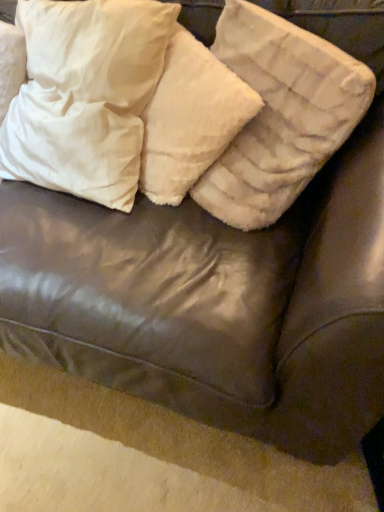
Identify the location of white fluffy pillow at upper center, the 2th pillow positioned from the right. (190, 118).

The image size is (384, 512). What do you see at coordinates (190, 118) in the screenshot? I see `white fluffy pillow at upper center, the 2th pillow positioned from the right` at bounding box center [190, 118].

At what (x,y) coordinates should I click in order to perform the action: click on white fluffy pillow at upper center, the 2th pillow positioned from the right. Please return your answer as a coordinate pair (x, y). The width and height of the screenshot is (384, 512). Looking at the image, I should click on (190, 118).

From the image's perspective, who appears lower, white soft pillow at upper left, which is the 3th pillow in right-to-left order, or white fluffy pillow at upper center, marked as the 1th pillow in a right-to-left arrangement?

From the image's view, white fluffy pillow at upper center, marked as the 1th pillow in a right-to-left arrangement, is below.

Who is more distant, white soft pillow at upper left, which is the 3th pillow in right-to-left order, or white fluffy pillow at upper center, marked as the 1th pillow in a right-to-left arrangement?

white soft pillow at upper left, which is the 3th pillow in right-to-left order, is further away from the camera.

Is white soft pillow at upper left, positioned as the 1th pillow in left-to-right order, oriented away from white fluffy pillow at upper center, marked as the 1th pillow in a right-to-left arrangement?

That's not correct — white soft pillow at upper left, positioned as the 1th pillow in left-to-right order, is not looking away from white fluffy pillow at upper center, marked as the 1th pillow in a right-to-left arrangement.

Can you confirm if white soft pillow at upper left, which is the 3th pillow in right-to-left order, is taller than white fluffy pillow at upper center, marked as the 1th pillow in a right-to-left arrangement?

Indeed, white soft pillow at upper left, which is the 3th pillow in right-to-left order, has a greater height compared to white fluffy pillow at upper center, marked as the 1th pillow in a right-to-left arrangement.

Which is more to the right, white fluffy pillow at upper center, marked as the 1th pillow in a right-to-left arrangement, or white soft pillow at upper left, positioned as the 1th pillow in left-to-right order?

white fluffy pillow at upper center, marked as the 1th pillow in a right-to-left arrangement.

Considering the relative sizes of white fluffy pillow at upper center, marked as the 1th pillow in a right-to-left arrangement, and white soft pillow at upper left, positioned as the 1th pillow in left-to-right order, in the image provided, is white fluffy pillow at upper center, marked as the 1th pillow in a right-to-left arrangement, bigger than white soft pillow at upper left, positioned as the 1th pillow in left-to-right order,?

Incorrect, white fluffy pillow at upper center, marked as the 1th pillow in a right-to-left arrangement, is not larger than white soft pillow at upper left, positioned as the 1th pillow in left-to-right order.

How much distance is there between white fluffy pillow at upper center, which is counted as the 3th pillow, starting from the left, and white soft pillow at upper left, which is the 3th pillow in right-to-left order?

They are 11.86 inches apart.

From a real-world perspective, is white fluffy pillow at upper center, which is counted as the 3th pillow, starting from the left, on white soft pillow at upper left, positioned as the 1th pillow in left-to-right order?

Yes, from a real-world perspective, white fluffy pillow at upper center, which is counted as the 3th pillow, starting from the left, is on top of white soft pillow at upper left, positioned as the 1th pillow in left-to-right order.

Does white soft pillow at upper left, positioned as the 1th pillow in left-to-right order, lie in front of white fluffy pillow at upper center, the 2th pillow positioned from the right?

That is True.

Considering the sizes of objects white soft pillow at upper left, which is the 3th pillow in right-to-left order, and white fluffy pillow at upper center, the 2th pillow positioned from the right, in the image provided, who is smaller, white soft pillow at upper left, which is the 3th pillow in right-to-left order, or white fluffy pillow at upper center, the 2th pillow positioned from the right,?

white fluffy pillow at upper center, the 2th pillow positioned from the right.

From the image's perspective, which one is positioned higher, white soft pillow at upper left, positioned as the 1th pillow in left-to-right order, or white fluffy pillow at upper center, the 2th pillow positioned from the right?

From the image's view, white soft pillow at upper left, positioned as the 1th pillow in left-to-right order, is above.

Which is farther from the camera, (87, 138) or (170, 151)?

The point (170, 151) is farther.

Which of these two, white fluffy pillow at upper center, the 2th pillow positioned from the right, or white fluffy pillow at upper center, which is counted as the 3th pillow, starting from the left, is bigger?

white fluffy pillow at upper center, which is counted as the 3th pillow, starting from the left.

From the image's perspective, between white fluffy pillow at upper center, the 2th pillow positioned from the right, and white fluffy pillow at upper center, which is counted as the 3th pillow, starting from the left, which one is located above?

white fluffy pillow at upper center, which is counted as the 3th pillow, starting from the left, from the image's perspective.

Which is more to the right, white fluffy pillow at upper center, the 2th pillow positioned from the right, or white fluffy pillow at upper center, marked as the 1th pillow in a right-to-left arrangement?

white fluffy pillow at upper center, marked as the 1th pillow in a right-to-left arrangement, is more to the right.

Is white fluffy pillow at upper center, the 2th pillow positioned from the right, turned away from white fluffy pillow at upper center, which is counted as the 3th pillow, starting from the left?

Yes, white fluffy pillow at upper center, the 2th pillow positioned from the right,'s orientation is away from white fluffy pillow at upper center, which is counted as the 3th pillow, starting from the left.

From a real-world perspective, is white fluffy pillow at upper center, arranged as the 2th pillow when viewed from the left, on top of white soft pillow at upper left, positioned as the 1th pillow in left-to-right order?

No, from a real-world perspective, white fluffy pillow at upper center, arranged as the 2th pillow when viewed from the left, is not over white soft pillow at upper left, positioned as the 1th pillow in left-to-right order

From their relative heights in the image, would you say white fluffy pillow at upper center, the 2th pillow positioned from the right, is taller or shorter than white soft pillow at upper left, positioned as the 1th pillow in left-to-right order?

Considering their sizes, white fluffy pillow at upper center, the 2th pillow positioned from the right, has less height than white soft pillow at upper left, positioned as the 1th pillow in left-to-right order.

Considering the sizes of white fluffy pillow at upper center, the 2th pillow positioned from the right, and white soft pillow at upper left, which is the 3th pillow in right-to-left order, in the image, is white fluffy pillow at upper center, the 2th pillow positioned from the right, wider or thinner than white soft pillow at upper left, which is the 3th pillow in right-to-left order,?

Considering their sizes, white fluffy pillow at upper center, the 2th pillow positioned from the right, looks slimmer than white soft pillow at upper left, which is the 3th pillow in right-to-left order.

Is white fluffy pillow at upper center, marked as the 1th pillow in a right-to-left arrangement, oriented away from white fluffy pillow at upper center, arranged as the 2th pillow when viewed from the left?

Yes, white fluffy pillow at upper center, marked as the 1th pillow in a right-to-left arrangement,'s orientation is away from white fluffy pillow at upper center, arranged as the 2th pillow when viewed from the left.

Is white fluffy pillow at upper center, marked as the 1th pillow in a right-to-left arrangement, far from white fluffy pillow at upper center, the 2th pillow positioned from the right?

No, white fluffy pillow at upper center, marked as the 1th pillow in a right-to-left arrangement, is not far away from white fluffy pillow at upper center, the 2th pillow positioned from the right.

From a real-world perspective, which object rests below the other?

In real-world perspective, white fluffy pillow at upper center, arranged as the 2th pillow when viewed from the left, is lower.

Is white fluffy pillow at upper center, arranged as the 2th pillow when viewed from the left, a part of white fluffy pillow at upper center, which is counted as the 3th pillow, starting from the left?

Yes, white fluffy pillow at upper center, arranged as the 2th pillow when viewed from the left, is a part of white fluffy pillow at upper center, which is counted as the 3th pillow, starting from the left.

Where is `pillow that appears in front of the white soft pillow at upper left, positioned as the 1th pillow in left-to-right order`? pillow that appears in front of the white soft pillow at upper left, positioned as the 1th pillow in left-to-right order is located at coordinates (280, 114).

From the image's perspective, count 1st pillows downward from the white soft pillow at upper left, which is the 3th pillow in right-to-left order, and point to it. Please provide its 2D coordinates.

[(280, 114)]

From the image, which object appears to be nearer to white soft pillow at upper left, positioned as the 1th pillow in left-to-right order, white fluffy pillow at upper center, marked as the 1th pillow in a right-to-left arrangement, or white fluffy pillow at upper center, arranged as the 2th pillow when viewed from the left?

Among the two, white fluffy pillow at upper center, arranged as the 2th pillow when viewed from the left, is located nearer to white soft pillow at upper left, positioned as the 1th pillow in left-to-right order.

Which object lies nearer to the anchor point white fluffy pillow at upper center, which is counted as the 3th pillow, starting from the left, white soft pillow at upper left, positioned as the 1th pillow in left-to-right order, or white fluffy pillow at upper center, the 2th pillow positioned from the right?

white fluffy pillow at upper center, the 2th pillow positioned from the right, is positioned closer to the anchor white fluffy pillow at upper center, which is counted as the 3th pillow, starting from the left.

When comparing their distances from white fluffy pillow at upper center, which is counted as the 3th pillow, starting from the left, does white fluffy pillow at upper center, the 2th pillow positioned from the right, or white soft pillow at upper left, positioned as the 1th pillow in left-to-right order, seem closer?

white fluffy pillow at upper center, the 2th pillow positioned from the right, is closer to white fluffy pillow at upper center, which is counted as the 3th pillow, starting from the left.

In the scene shown: Which object lies further to the anchor point white fluffy pillow at upper center, the 2th pillow positioned from the right, white fluffy pillow at upper center, which is counted as the 3th pillow, starting from the left, or white soft pillow at upper left, which is the 3th pillow in right-to-left order?

Among the two, white soft pillow at upper left, which is the 3th pillow in right-to-left order, is located further to white fluffy pillow at upper center, the 2th pillow positioned from the right.

Which object lies nearer to the anchor point white fluffy pillow at upper center, arranged as the 2th pillow when viewed from the left, white soft pillow at upper left, positioned as the 1th pillow in left-to-right order, or white fluffy pillow at upper center, marked as the 1th pillow in a right-to-left arrangement?

Among the two, white fluffy pillow at upper center, marked as the 1th pillow in a right-to-left arrangement, is located nearer to white fluffy pillow at upper center, arranged as the 2th pillow when viewed from the left.

Which object lies nearer to the anchor point white soft pillow at upper left, positioned as the 1th pillow in left-to-right order, white fluffy pillow at upper center, the 2th pillow positioned from the right, or white fluffy pillow at upper center, which is counted as the 3th pillow, starting from the left?

white fluffy pillow at upper center, the 2th pillow positioned from the right, is closer to white soft pillow at upper left, positioned as the 1th pillow in left-to-right order.

Find the location of a particular element. pillow between white soft pillow at upper left, which is the 3th pillow in right-to-left order, and white fluffy pillow at upper center, which is counted as the 3th pillow, starting from the left, from left to right is located at coordinates (190, 118).